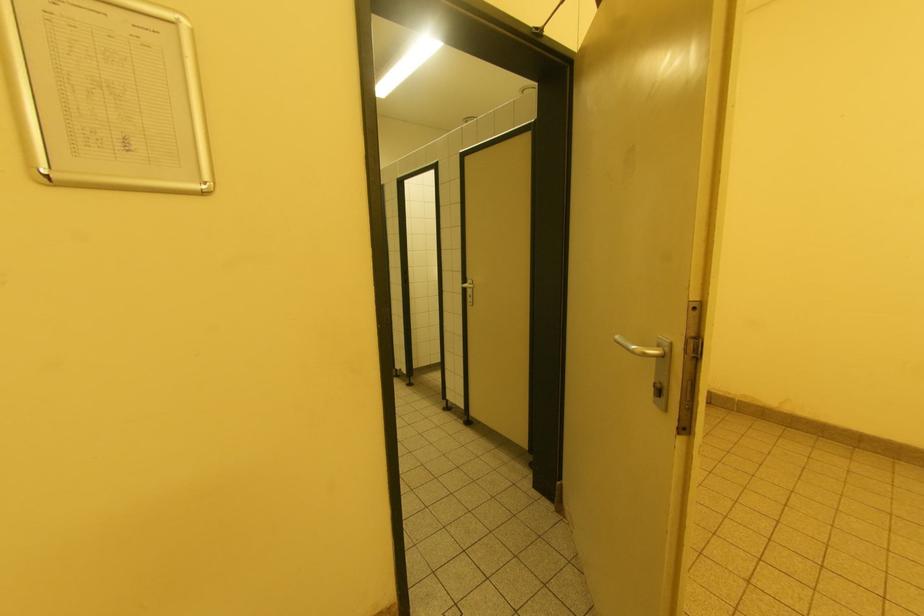
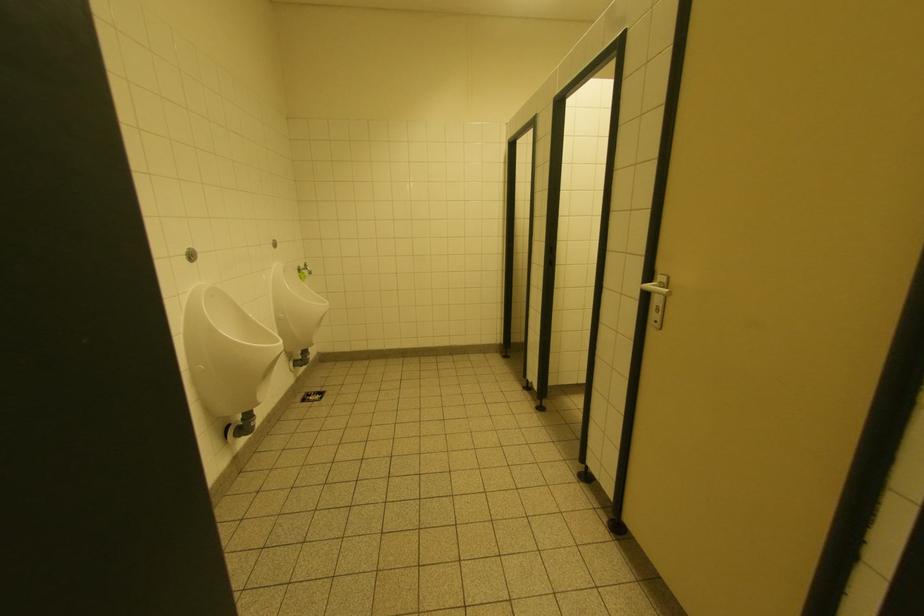
Question: The camera is either moving clockwise (left) or counter-clockwise (right) around the object. The first image is from the beginning of the video and the second image is from the end. Is the camera moving left or right when shooting the video?

Choices:
 (A) Left
 (B) Right

Answer: (B)